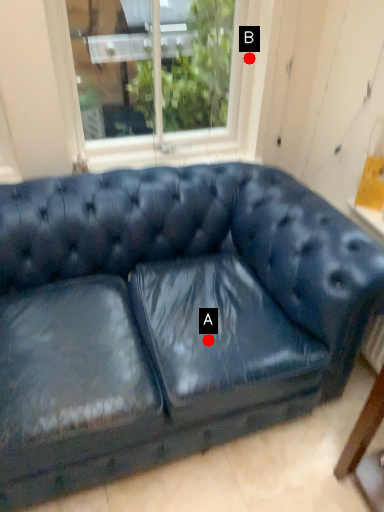
Question: Two points are circled on the image, labeled by A and B beside each circle. Which point is farther to the camera?

Choices:
 (A) A is further
 (B) B is further

Answer: (B)